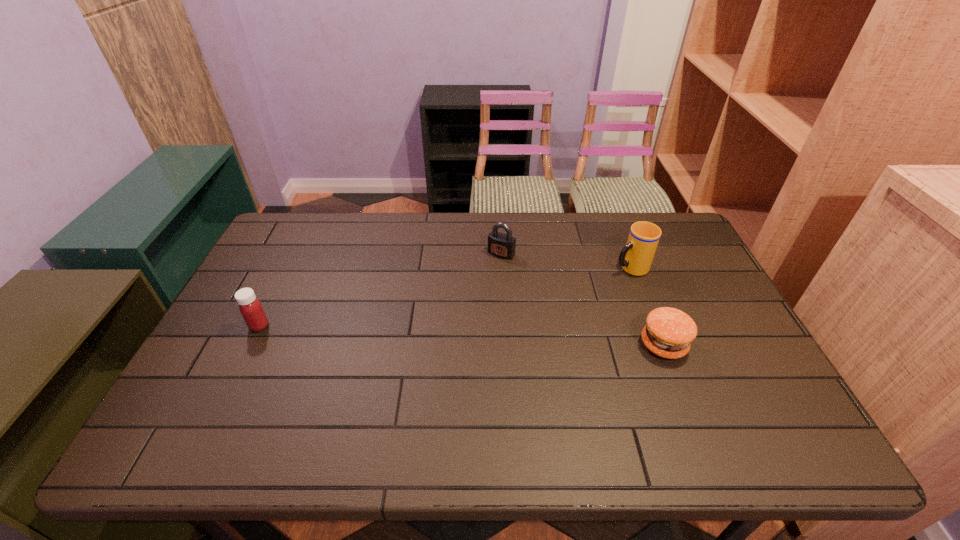
This screenshot has width=960, height=540. Find the location of `object that is the second closest to the patty`. object that is the second closest to the patty is located at coordinates (501, 245).

At what (x,y) coordinates should I click in order to perform the action: click on object identified as the second closest to the patty. Please return your answer as a coordinate pair (x, y). The height and width of the screenshot is (540, 960). Looking at the image, I should click on (501, 245).

Identify the location of vacant space that satisfies the following two spatial constraints: 1. on the front side of the padlock; 2. on the left side of the tallest object. (502, 267).